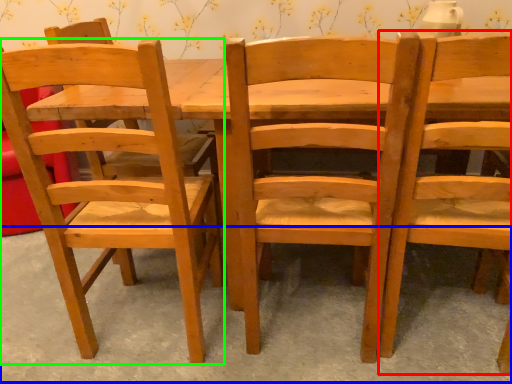
Question: Which is farther away from chair (highlighted by a red box)? concrete (highlighted by a blue box) or chair (highlighted by a green box)?

Choices:
 (A) concrete
 (B) chair

Answer: (B)